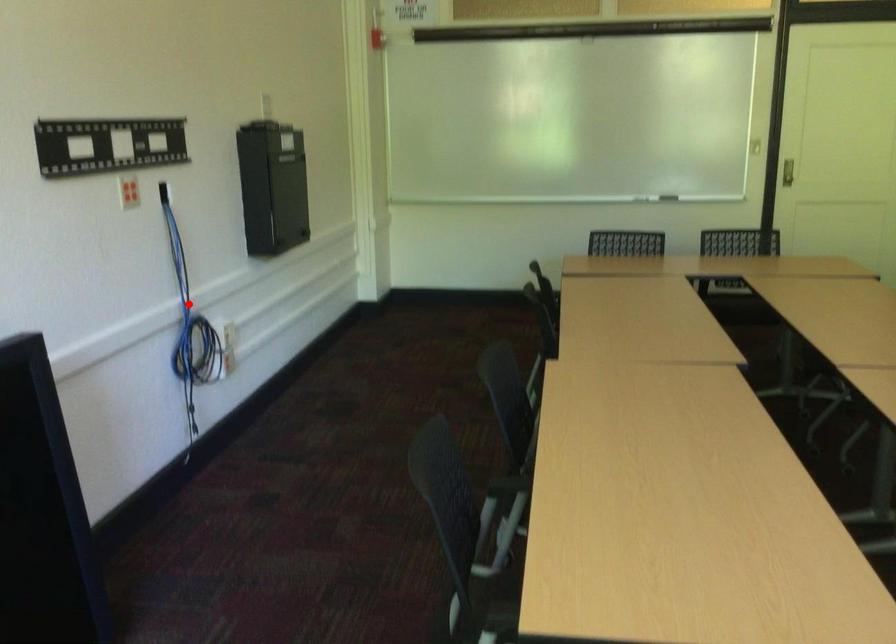
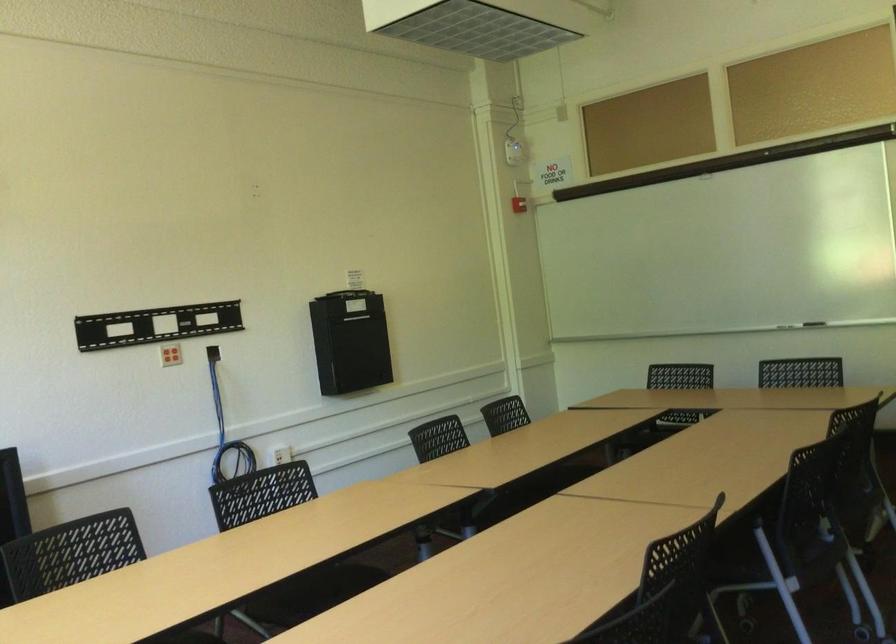
Question: I am providing you with two images of the same scene from different viewpoints. A red point is shown in image1. For the corresponding object point in image2, is it positioned nearer or farther from the camera?

Choices:
 (A) Nearer
 (B) Farther

Answer: (B)